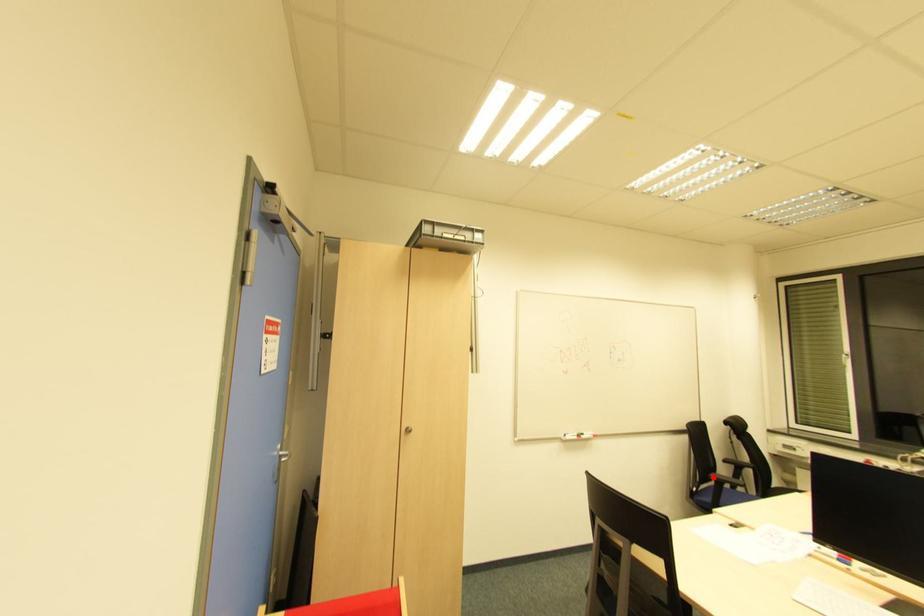
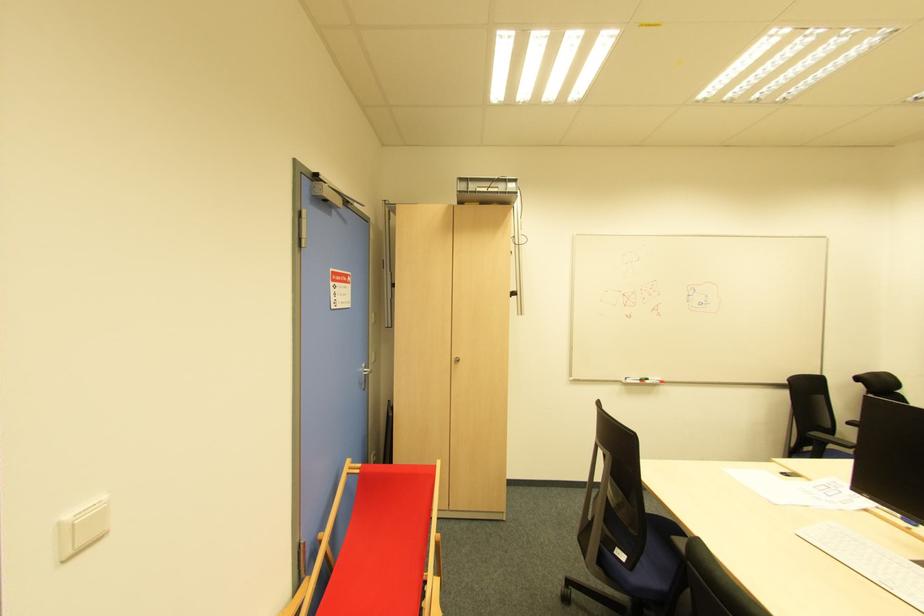
Where in the second image is the point corresponding to the highlighted location from the first image?

(817, 436)